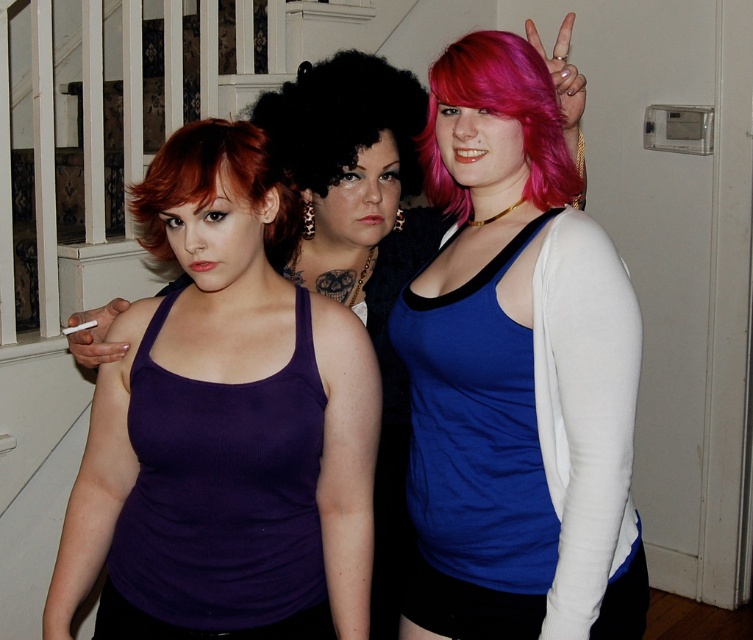
Question: Which object is closer to the camera taking this photo?

Choices:
 (A) pink matte hair at center
 (B) white matte cigarette at center
 (C) curly black hair at center

Answer: (A)

Question: Can you confirm if matte blue tank top at center is wider than curly black hair at center?

Choices:
 (A) yes
 (B) no

Answer: (A)

Question: Is the position of purple ribbed tank top at left less distant than that of white matte cigarette at center?

Choices:
 (A) no
 (B) yes

Answer: (B)

Question: Among these points, which one is nearest to the camera?

Choices:
 (A) (72, 326)
 (B) (175, 144)
 (C) (331, 99)
 (D) (104, 548)

Answer: (B)

Question: Estimate the real-world distances between objects in this image. Which object is farther from the curly black hair at center?

Choices:
 (A) shiny red hair at center
 (B) white matte cigarette at center

Answer: (B)

Question: Does pink matte hair at center have a greater width compared to shiny red hair at center?

Choices:
 (A) no
 (B) yes

Answer: (A)